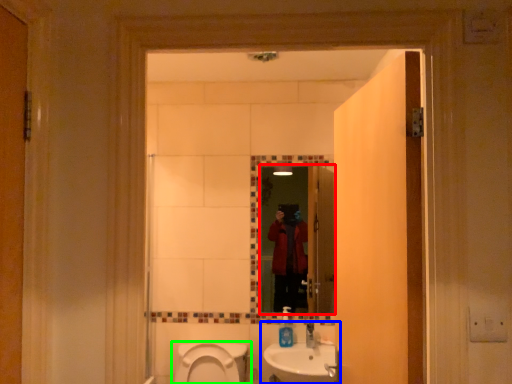
Question: Which is nearer to the mirror (highlighted by a red box)? sink (highlighted by a blue box) or toilet (highlighted by a green box).

Choices:
 (A) sink
 (B) toilet

Answer: (A)